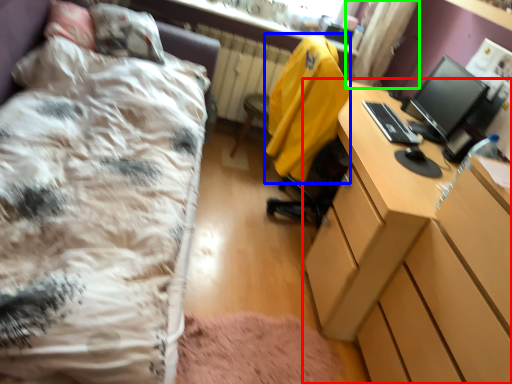
Question: Estimate the real-world distances between objects in this image. Which object is farther from desk (highlighted by a red box), jacket (highlighted by a blue box) or curtain (highlighted by a green box)?

Choices:
 (A) jacket
 (B) curtain

Answer: (B)